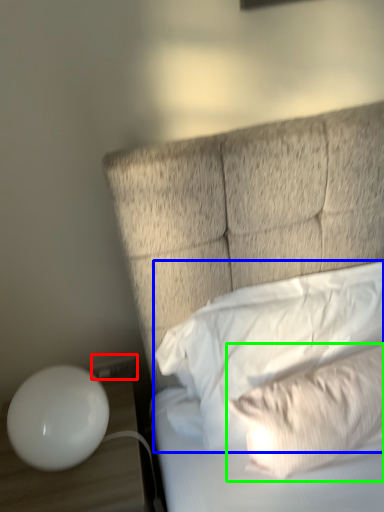
Question: Which object is positioned closest to electric outlet (highlighted by a red box)? Select from pillow (highlighted by a blue box) and pillow (highlighted by a green box).

Choices:
 (A) pillow
 (B) pillow

Answer: (A)